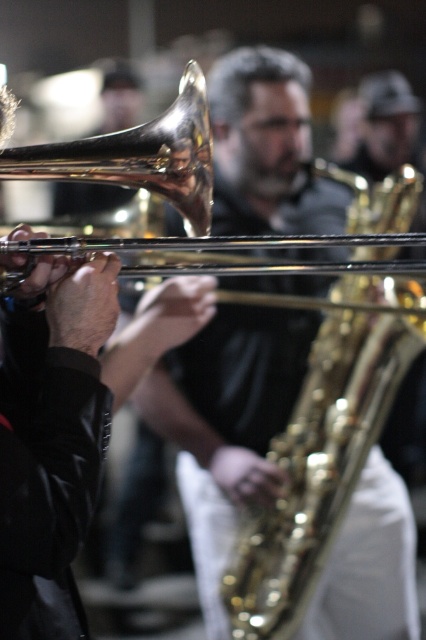
Based on the photo, who is higher up, gold shiny trumpet at center or shiny brass trombone at center?

Positioned higher is shiny brass trombone at center.

Can you confirm if gold shiny trumpet at center is positioned to the left of shiny brass trombone at center?

In fact, gold shiny trumpet at center is to the right of shiny brass trombone at center.

Which is behind, point (285, 600) or point (97, 154)?

Positioned behind is point (285, 600).

The width and height of the screenshot is (426, 640). What are the coordinates of `gold shiny trumpet at center` in the screenshot? It's located at (325, 435).